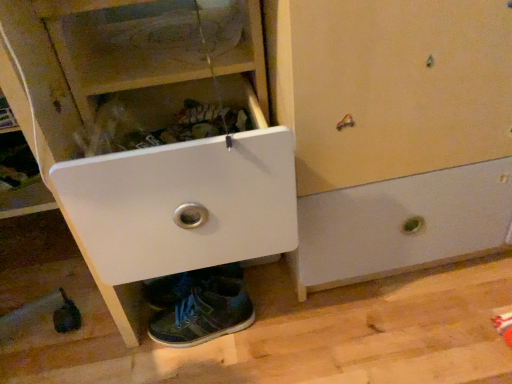
This screenshot has height=384, width=512. I want to click on vacant point to the right of green suede shoes at lower center, so click(x=284, y=322).